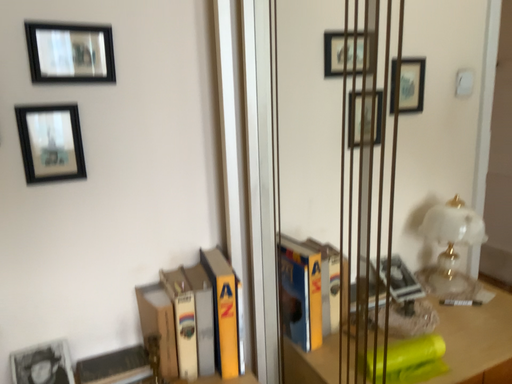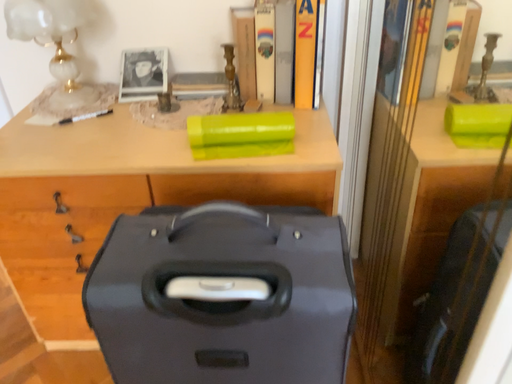
Question: Which way did the camera rotate in the video?

Choices:
 (A) rotated right
 (B) rotated left

Answer: (B)